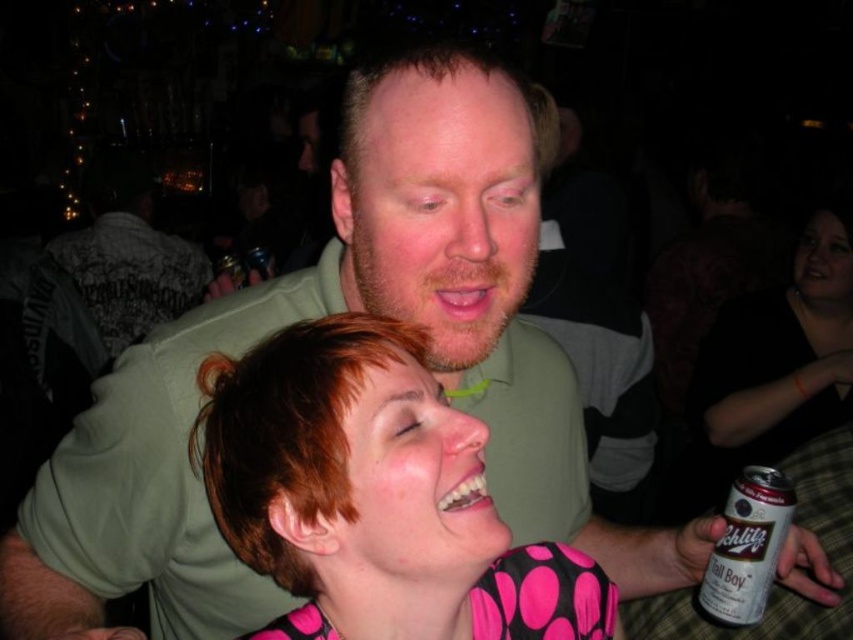
You are at a party and want to find the person wearing the pink dotted shirt at center. Which direction should you look relative to the matte green shirt at upper center?

The pink dotted shirt at center is located below the matte green shirt at upper center, so you should look downward from the matte green shirt at upper center to find the pink dotted shirt at center.

You are at a party and want to hand a note to the person wearing the pink dotted shirt at center without being noticed by the person holding the silver metallic can at lower right. Can you do this by placing the note on the shirt without the can holder noticing?

The pink dotted shirt at center is positioned over the silver metallic can at lower right, so placing the note on the shirt would be visible to the person holding the silver metallic can at lower right.